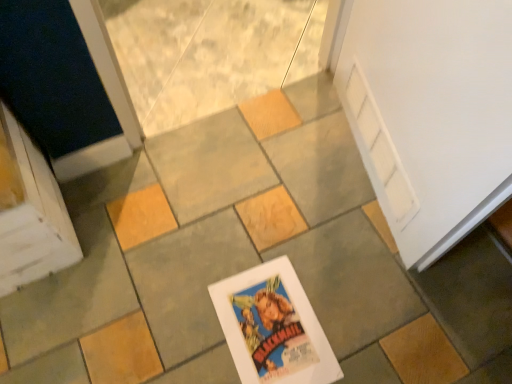
The height and width of the screenshot is (384, 512). In order to click on empty space that is ontop of white paper picture frame at center (from a real-world perspective) in this screenshot , I will do `click(270, 327)`.